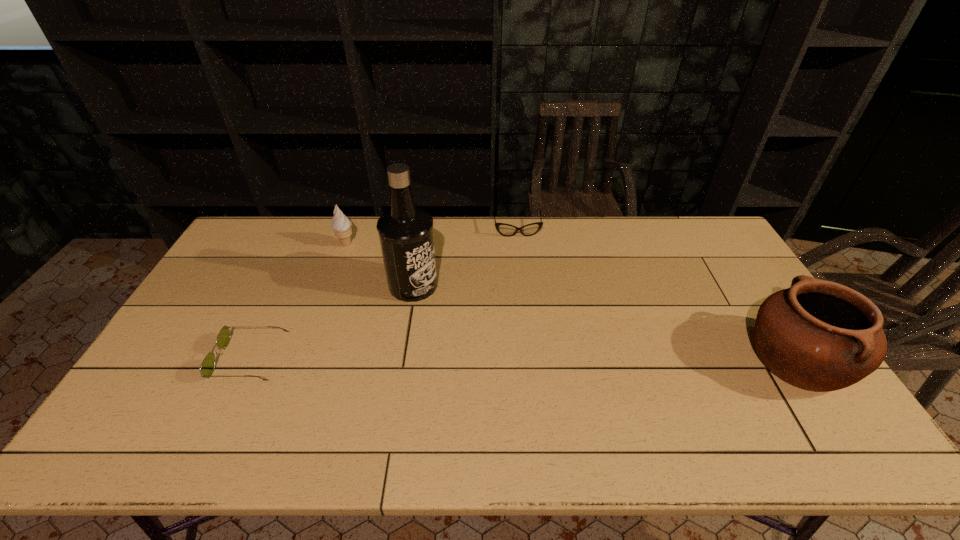
Image resolution: width=960 pixels, height=540 pixels. Identify the location of free space between the sunglasses and the spectacles. coord(383,294).

In order to click on free area in between the fourth shortest object and the icecream in this screenshot , I will do `click(571, 302)`.

Locate an element on the screen. The width and height of the screenshot is (960, 540). free space between the icecream and the sunglasses is located at coordinates (298, 301).

The width and height of the screenshot is (960, 540). Identify the location of free point between the sunglasses and the farthest object. (383, 294).

Locate an element on the screen. The width and height of the screenshot is (960, 540). object that is the second closest to the sunglasses is located at coordinates (341, 225).

Locate an element on the screen. the second closest object to the second object from right to left is located at coordinates (341, 225).

At what (x,y) coordinates should I click in order to perform the action: click on vacant space that satisfies the following two spatial constraints: 1. on the front side of the liquor; 2. on the right side of the rightmost object. Please return your answer as a coordinate pair (x, y). Image resolution: width=960 pixels, height=540 pixels. Looking at the image, I should click on (401, 360).

Where is `free space that satisfies the following two spatial constraints: 1. on the front side of the third shortest object; 2. on the left side of the fourth shortest object`? The height and width of the screenshot is (540, 960). free space that satisfies the following two spatial constraints: 1. on the front side of the third shortest object; 2. on the left side of the fourth shortest object is located at coordinates (303, 360).

Find the location of a particular element. free region that satisfies the following two spatial constraints: 1. on the back side of the spectacles; 2. on the right side of the icecream is located at coordinates (351, 230).